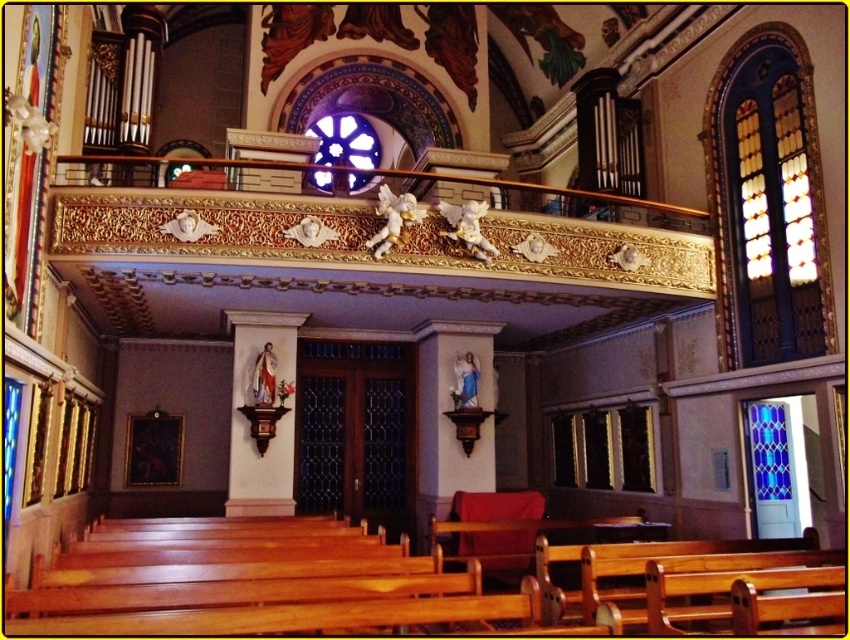
You are an architect designing a new church and want to ensure proper lighting. Considering the stained glass at upper right and the blue stained glass at right, which one is taller?

The stained glass at upper right is taller than the blue stained glass at right according to the description.

You are standing at the entrance of the church and looking towards the altar. There is a point marked at coordinates point [768,202]. Based on the scene description, what object or feature is located at that point?

The point [768,202] indicates stained glass at upper right.